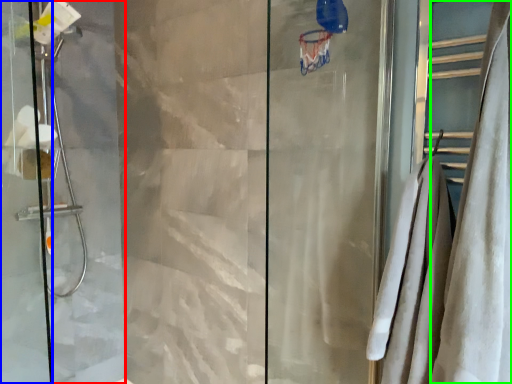
Question: Considering the real-world distances, which object is farthest from screen door (highlighted by a red box)? screen door (highlighted by a blue box) or shower curtain (highlighted by a green box)?

Choices:
 (A) screen door
 (B) shower curtain

Answer: (B)